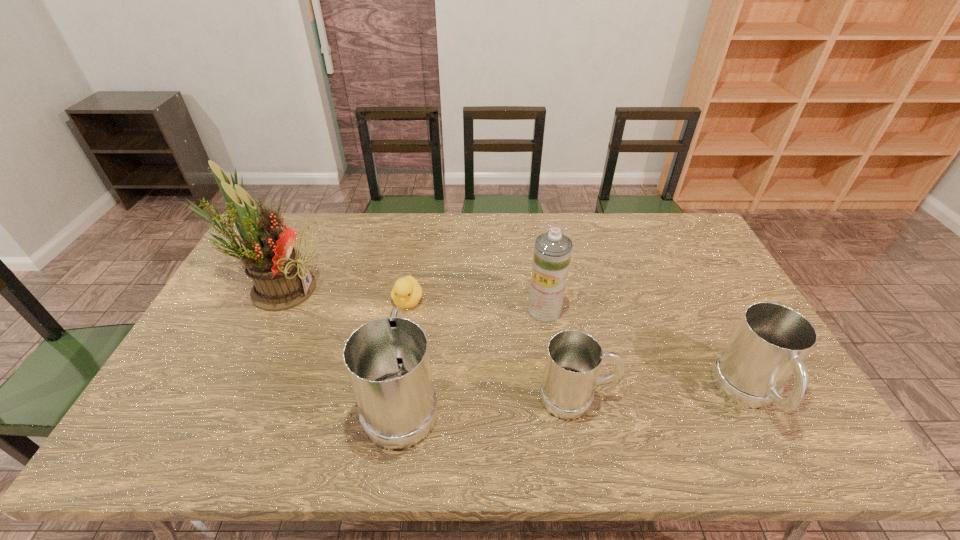
Where is `the leftmost mug`? The height and width of the screenshot is (540, 960). the leftmost mug is located at coordinates (387, 360).

Locate an element on the screen. the shortest mug is located at coordinates (573, 361).

What are the coordinates of `the second mug from left to right` in the screenshot? It's located at (573, 361).

Find the location of a particular element. The width and height of the screenshot is (960, 540). the rightmost mug is located at coordinates (767, 347).

At what (x,y) coordinates should I click in order to perform the action: click on the second shortest mug. Please return your answer as a coordinate pair (x, y). This screenshot has width=960, height=540. Looking at the image, I should click on (767, 347).

This screenshot has height=540, width=960. In order to click on aerosol can in this screenshot , I will do `click(552, 251)`.

What are the coordinates of `flower arrangement` in the screenshot? It's located at (282, 280).

This screenshot has width=960, height=540. What are the coordinates of `the leftmost object` in the screenshot? It's located at (282, 280).

Locate an element on the screen. The image size is (960, 540). the shortest object is located at coordinates (406, 293).

You are a GUI agent. You are given a task and a screenshot of the screen. Output one action in this format:
    pyautogui.click(x=<x>, y=<y>)
    Task: Click on the vacant space located on the side of the leftmost mug with the handle
    The image size is (960, 540).
    Given the screenshot: What is the action you would take?
    pyautogui.click(x=418, y=300)